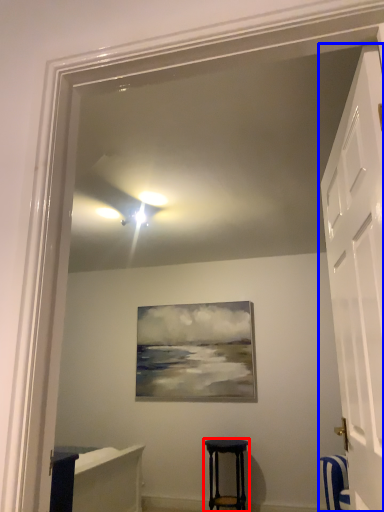
Question: Which of the following is the closest to the observer, stool (highlighted by a red box) or door (highlighted by a blue box)?

Choices:
 (A) stool
 (B) door

Answer: (B)